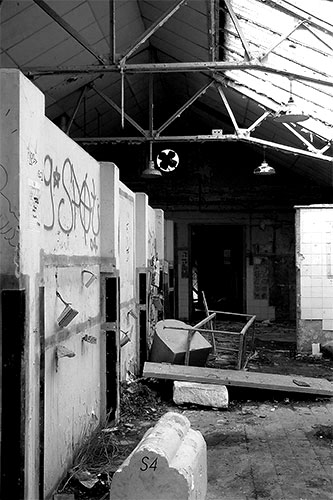
The width and height of the screenshot is (333, 500). Identify the location of fan. point(166,157).